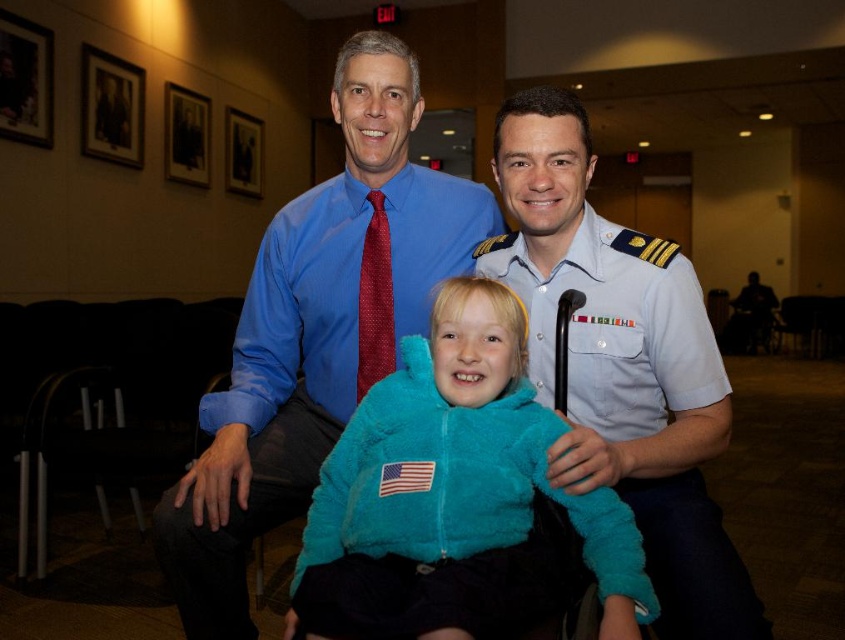
Please look at the image and identify the object located at the coordinates point (453, 493). Which object is it?

The object at point (453, 493) is the turquoise fuzzy jacket at center.

You are a photographer setting up for a group photo. You need to position a light to the right of the blue shirt at center and to the left of the red dotted tie at center. Is there enough space between them to place the light?

The blue shirt at center is to the left of the red dotted tie at center, so there is space between them to place the light.

Consider the image. You are a photographer setting up for a group photo. You notice two people in the front row wearing a turquoise fuzzy jacket at center and a light blue uniform at center. Which one is positioned closer to the camera?

The turquoise fuzzy jacket at center is closer to the viewer than the light blue uniform at center, so the person wearing the turquoise fuzzy jacket at center is positioned closer to the camera.